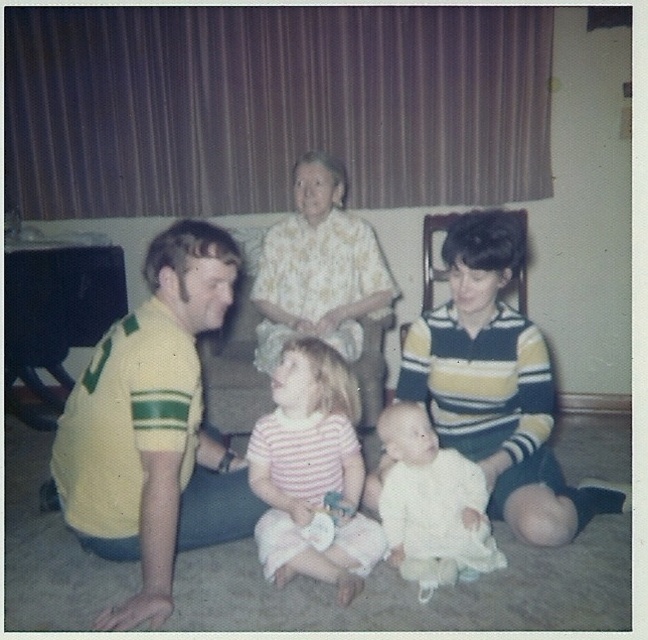
You are a photographer trying to capture a candid shot of the two adults wearing yellow in the family photo. The camera you have can only focus on subjects within a 20 inch range. Given the distance between the yellow jersey at left and the yellow striped polo shirt at left, can you capture both in a single focused shot?

The yellow jersey at left and yellow striped polo shirt at left are 24.06 inches apart, which exceeds the camera focus range of 20 inches. Therefore, you cannot capture both in a single focused shot.

You are standing in the living room and want to reach both points, point (145, 282) and point (456, 424). Which point will you reach first?

Point (145, 282) is closer to you, so you will reach it first.

You are a photographer trying to capture a candid shot of the yellow jersey at left and the white soft baby at center. The camera you are using has a minimum focus distance of 20 inches. Can you take a photo of both subjects without moving them?

The yellow jersey at left and the white soft baby at center are 19.84 inches apart, which is less than the camera minimum focus distance of 20 inches. Therefore, you cannot take a photo of both subjects without moving them.